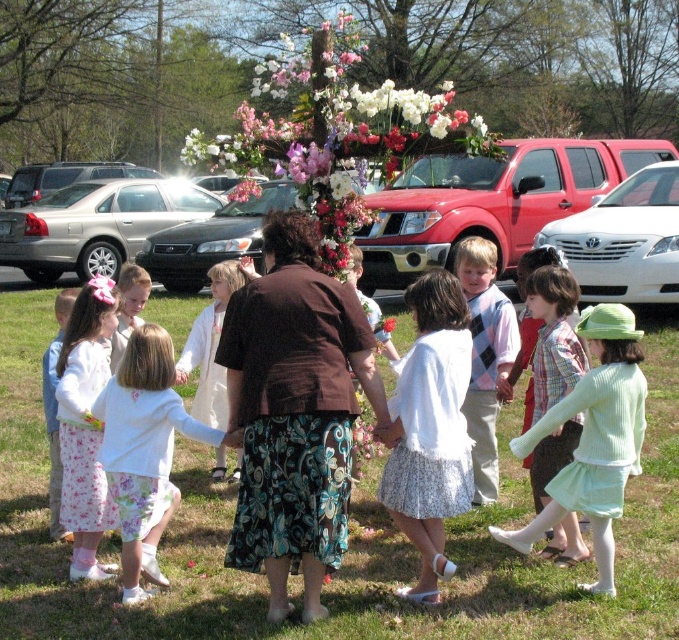
Between white floral skirt at center and argyle sweater vest at center, which one has less height?

white floral skirt at center

Is point (155, 333) closer to camera compared to point (469, 394)?

Yes, point (155, 333) is closer to viewer.

Describe the element at coordinates (145, 449) in the screenshot. I see `white floral skirt at center` at that location.

Find the location of a particular element. Image resolution: width=679 pixels, height=640 pixels. white floral skirt at center is located at coordinates (145, 449).

Can you confirm if light green fabric dress at lower right is wider than white floral skirt at center?

Incorrect, light green fabric dress at lower right's width does not surpass white floral skirt at center's.

Is point (619, 504) less distant than point (204, 426)?

Yes.

The image size is (679, 640). I want to click on light green fabric dress at lower right, so click(x=593, y=440).

Where is `floral arrangement at center`? This screenshot has height=640, width=679. floral arrangement at center is located at coordinates (335, 129).

Measure the distance between point (329, 269) and camera.

Point (329, 269) is 23.22 feet from camera.

Find the location of a particular element. The width and height of the screenshot is (679, 640). floral arrangement at center is located at coordinates (335, 129).